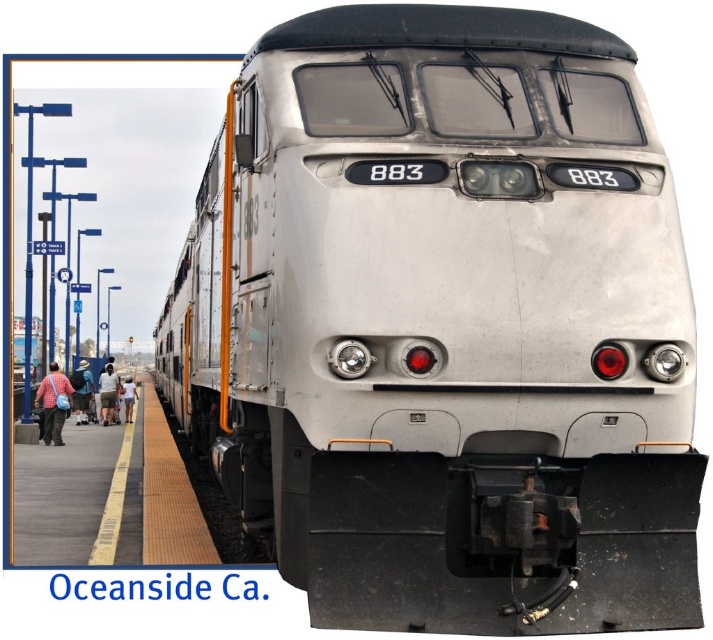
You are standing on the platform at Oceanside, California, and you see two points marked on the train labeled 883. The first point is at coordinates point (82,413) and the second is at point (106,388). Which point is nearer to you as you look at the train?

Point (82,413) is closer to the camera than point (106,388), so the first point is nearer to you.

You are a passenger waiting on the platform at Oceanside, California. You notice two items at the lower left of your view. One is checkered shirt fabric at lower left and the other is light blue denim shorts at lower left. Which item is positioned to the right?

The checkered shirt fabric at lower left is to the right of light blue denim shorts at lower left.

You are standing on the Oceanside platform and see two points marked in the image. Which point is closer to you, point (x=81, y=385) or point (x=123, y=401)?

Point (x=81, y=385) is in front of point (x=123, y=401), so it is closer to you.